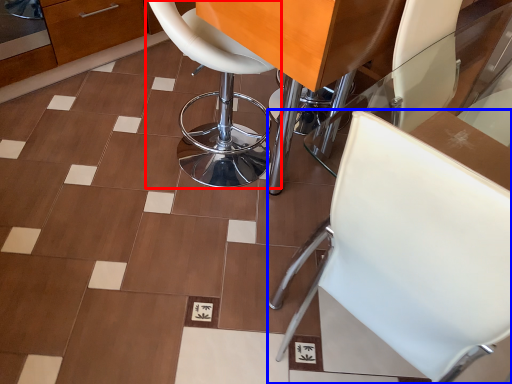
Question: Which object appears closest to the camera in this image, chair (highlighted by a red box) or chair (highlighted by a blue box)?

Choices:
 (A) chair
 (B) chair

Answer: (B)